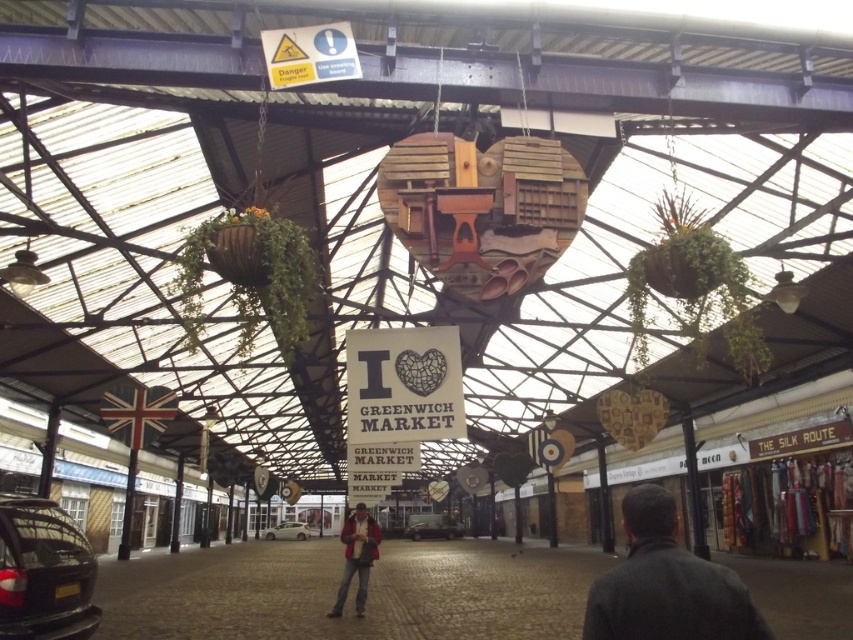
Question: Which point is closer to the camera taking this photo?

Choices:
 (A) (412, 516)
 (B) (363, 536)

Answer: (B)

Question: Which is nearer to the light yellow plastic car at center?

Choices:
 (A) metallic silver car at center
 (B) red jacket at center
 (C) dark gray coat at lower right
 (D) shiny black car at lower left

Answer: (B)

Question: Which of the following is the closest to the observer?

Choices:
 (A) red jacket at center
 (B) metallic silver car at center
 (C) dark gray coat at lower right
 (D) shiny black car at lower left

Answer: (C)

Question: Does red jacket at center appear on the left side of light yellow plastic car at center?

Choices:
 (A) yes
 (B) no

Answer: (B)

Question: Is dark gray coat at lower right further to camera compared to shiny black car at lower left?

Choices:
 (A) yes
 (B) no

Answer: (B)

Question: Does shiny black car at lower left appear under red jacket at center?

Choices:
 (A) no
 (B) yes

Answer: (A)